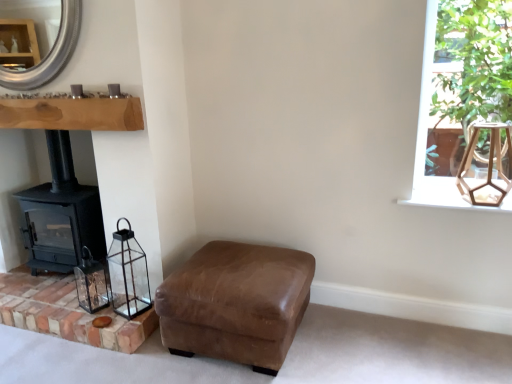
The image size is (512, 384). In order to click on blank area beneath green leafy plant at upper right (from a real-world perspective) in this screenshot , I will do `click(467, 189)`.